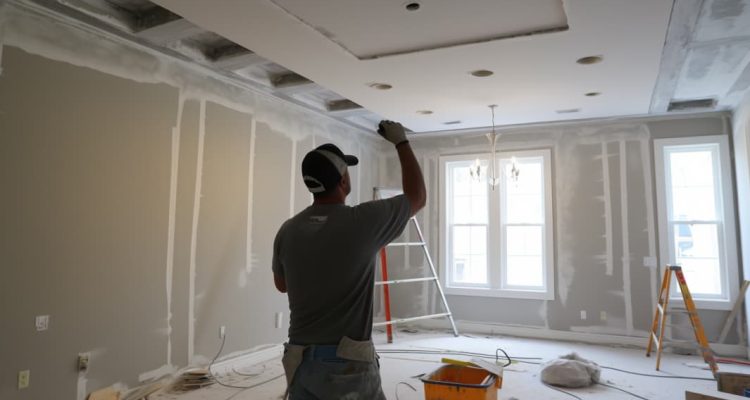
In order to click on light in this screenshot , I will do `click(490, 138)`.